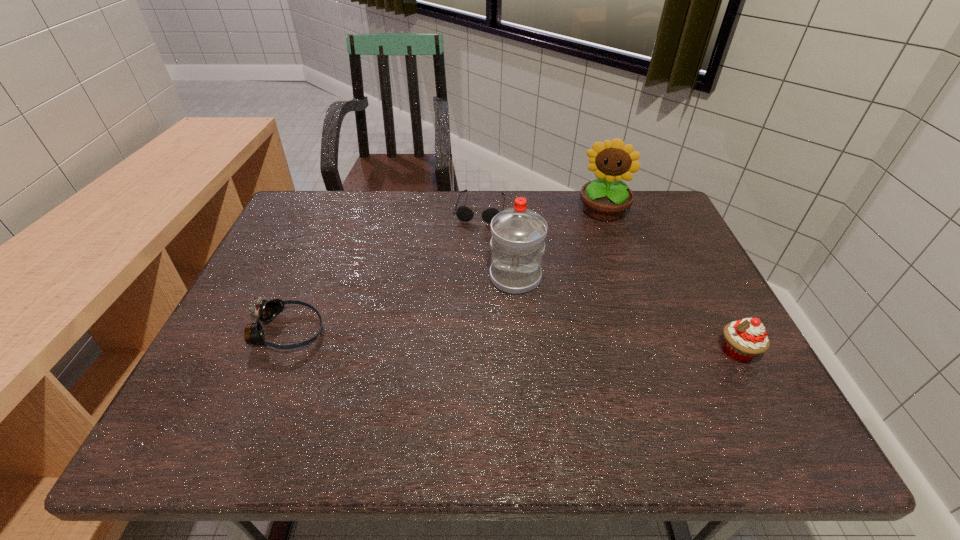
Where is `object at the left edge`? The width and height of the screenshot is (960, 540). object at the left edge is located at coordinates (265, 311).

This screenshot has width=960, height=540. I want to click on cupcake located in the right edge section of the desktop, so tap(745, 339).

Locate an element on the screen. Image resolution: width=960 pixels, height=540 pixels. sunflower that is positioned at the right edge is located at coordinates (606, 199).

I want to click on object located in the far right corner section of the desktop, so click(x=606, y=199).

You are a GUI agent. You are given a task and a screenshot of the screen. Output one action in this format:
    pyautogui.click(x=<x>, y=<y>)
    Task: Click on the object situated at the near right corner
    
    Given the screenshot: What is the action you would take?
    pyautogui.click(x=745, y=339)

The width and height of the screenshot is (960, 540). In the image, there is a desktop. In order to click on vacant region at the far edge in this screenshot , I will do `click(553, 198)`.

The image size is (960, 540). Find the location of `vacant space at the near edge`. vacant space at the near edge is located at coordinates (578, 373).

The width and height of the screenshot is (960, 540). Find the location of `free space at the left edge`. free space at the left edge is located at coordinates (296, 308).

At what (x,y) coordinates should I click in order to perform the action: click on free space at the right edge of the desktop. Please return your answer as a coordinate pair (x, y). The width and height of the screenshot is (960, 540). Looking at the image, I should click on (670, 236).

Where is `vacant space at the far left corner of the desktop`? The width and height of the screenshot is (960, 540). vacant space at the far left corner of the desktop is located at coordinates (328, 221).